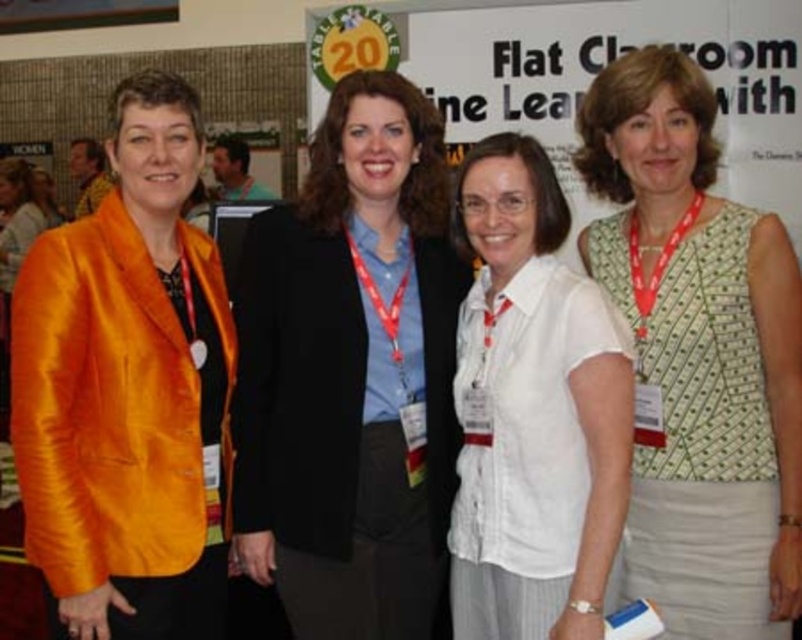
Based on the scene description, which object is larger in size between the green dotted vest at center and the white cotton shirt at center?

The green dotted vest at center is larger in size compared to the white cotton shirt at center.

You are standing at the origin point in the image. There are two points marked in the scene, point (282, 378) and point (770, 621). Which point is closer to you?

Point (770, 621) is closer to you because it is in front of point (282, 378).